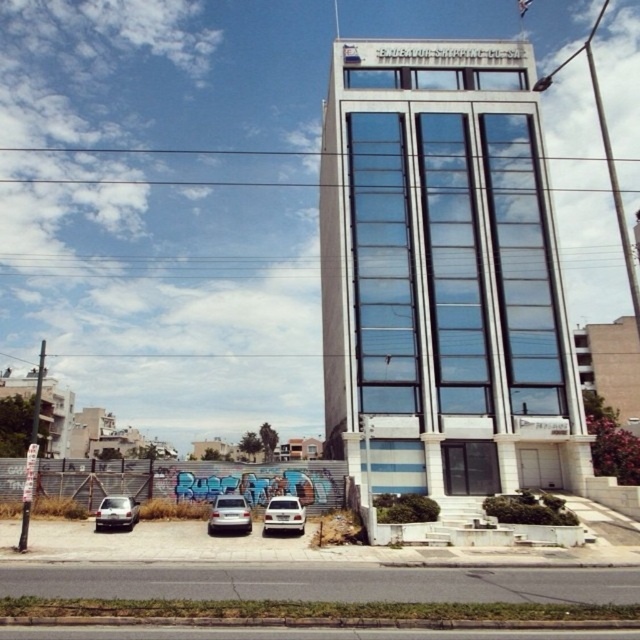
You are standing at the entrance of the building and want to locate the satin silver car at lower center. According to the coordinates provided, in which direction should you look to find it?

The satin silver car at lower center is located at coordinates point (228, 515), so you should look towards the lower center direction to find it.